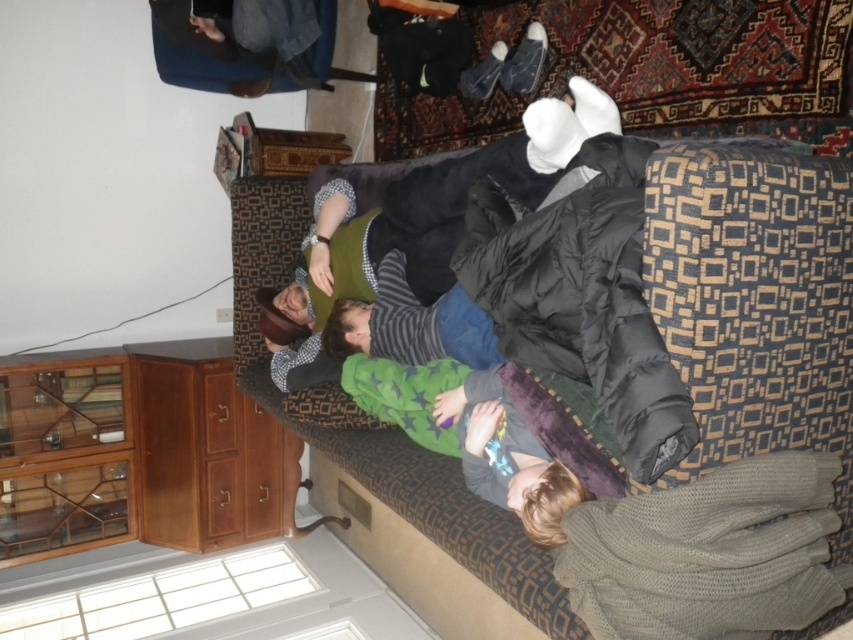
Question: Is dark brown fabric couch at center further to camera compared to green knitted sleeping bag at lower right?

Choices:
 (A) no
 (B) yes

Answer: (A)

Question: Which object is positioned farthest from the green fabric shirt at center?

Choices:
 (A) green fuzzy blanket at center
 (B) dark brown fabric couch at center
 (C) green knitted sleeping bag at lower right

Answer: (C)

Question: Does dark brown fabric couch at center appear on the right side of green knitted sleeping bag at lower right?

Choices:
 (A) yes
 (B) no

Answer: (B)

Question: From the image, what is the correct spatial relationship of dark brown fabric couch at center in relation to green fabric shirt at center?

Choices:
 (A) left
 (B) right

Answer: (B)

Question: Among these points, which one is nearest to the camera?

Choices:
 (A) (294, 317)
 (B) (786, 449)
 (C) (363, 355)

Answer: (B)

Question: Among these points, which one is nearest to the camera?

Choices:
 (A) (834, 346)
 (B) (547, 140)
 (C) (775, 620)

Answer: (C)